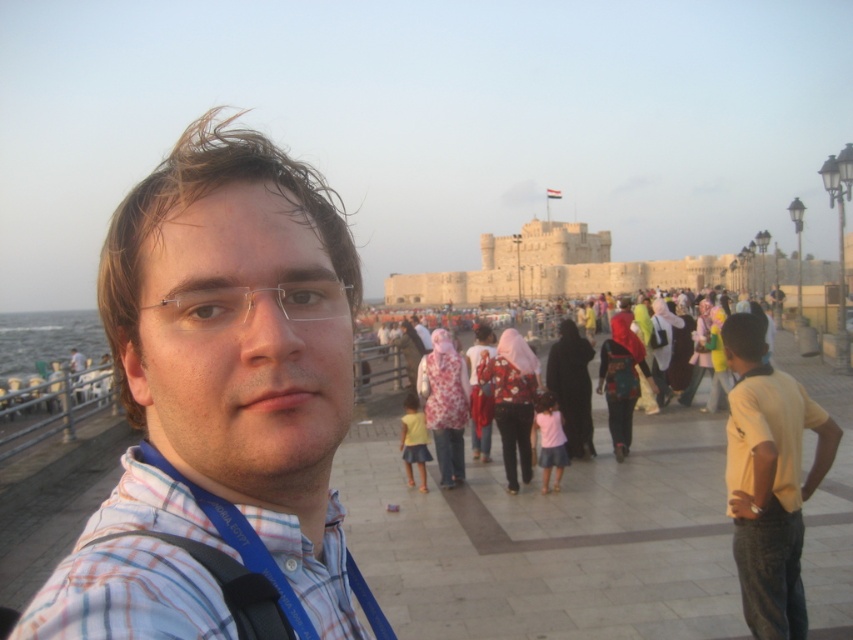
Between plaid shirt at center and yellow cotton shirt at right, which one appears on the left side from the viewer's perspective?

plaid shirt at center

How much distance is there between plaid shirt at center and yellow cotton shirt at right?

plaid shirt at center and yellow cotton shirt at right are 40.01 meters apart from each other.

Between point (254, 196) and point (788, 618), which one is positioned in front?

Positioned in front is point (254, 196).

Image resolution: width=853 pixels, height=640 pixels. Find the location of `plaid shirt at center`. plaid shirt at center is located at coordinates (221, 397).

The height and width of the screenshot is (640, 853). What do you see at coordinates (221, 397) in the screenshot?
I see `plaid shirt at center` at bounding box center [221, 397].

Does plaid shirt at center appear on the right side of multicolored fabric people at center?

No, plaid shirt at center is not to the right of multicolored fabric people at center.

Locate an element on the screen. Image resolution: width=853 pixels, height=640 pixels. plaid shirt at center is located at coordinates (221, 397).

Where is `plaid shirt at center`? Image resolution: width=853 pixels, height=640 pixels. plaid shirt at center is located at coordinates (221, 397).

Is yellow cotton shirt at right positioned behind multicolored fabric people at center?

No, it is not.

Between point (791, 600) and point (584, 364), which one is positioned in front?

Point (791, 600) is more forward.

The image size is (853, 640). I want to click on yellow cotton shirt at right, so click(769, 480).

At what (x,y) coordinates should I click in order to perform the action: click on yellow cotton shirt at right. Please return your answer as a coordinate pair (x, y). Looking at the image, I should click on (769, 480).